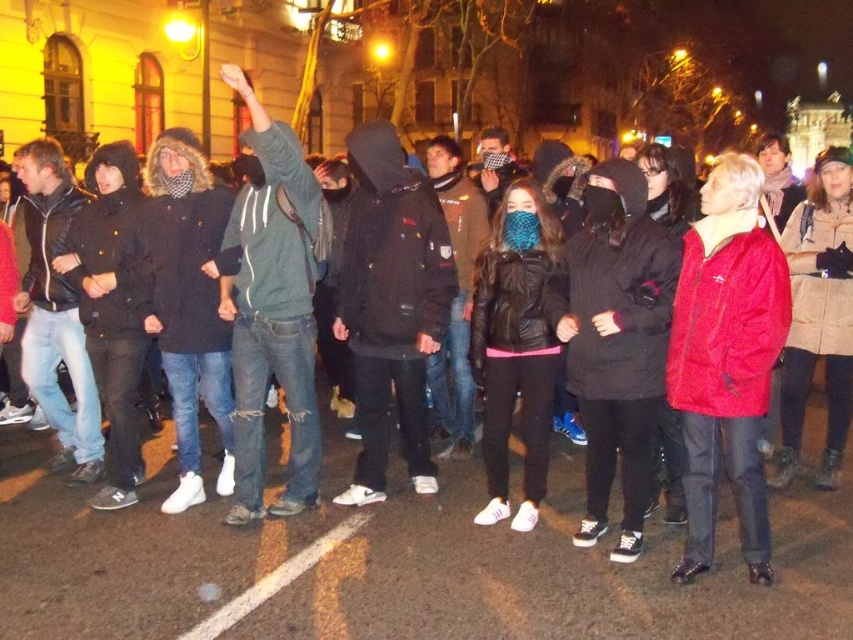
You are a photographer positioned at the center of the scene. You want to take a photo that includes both the point at (x=706, y=385) and the point at (x=242, y=358). Which point should you focus on first to ensure both are in the frame?

You should focus on point (x=706, y=385) first because it is in front of point (x=242, y=358), so adjusting the camera to include the closer point will naturally include the one behind it.

You are a photographer trying to capture a candid shot of the protest. You notice the velvet red jacket at center and the ripped denim jeans at center. Which object should you focus on first if you want to photograph the lower part of the person first?

The velvet red jacket at center is located below the ripped denim jeans at center, so you should focus on the velvet red jacket at center first to capture the lower part of the person.